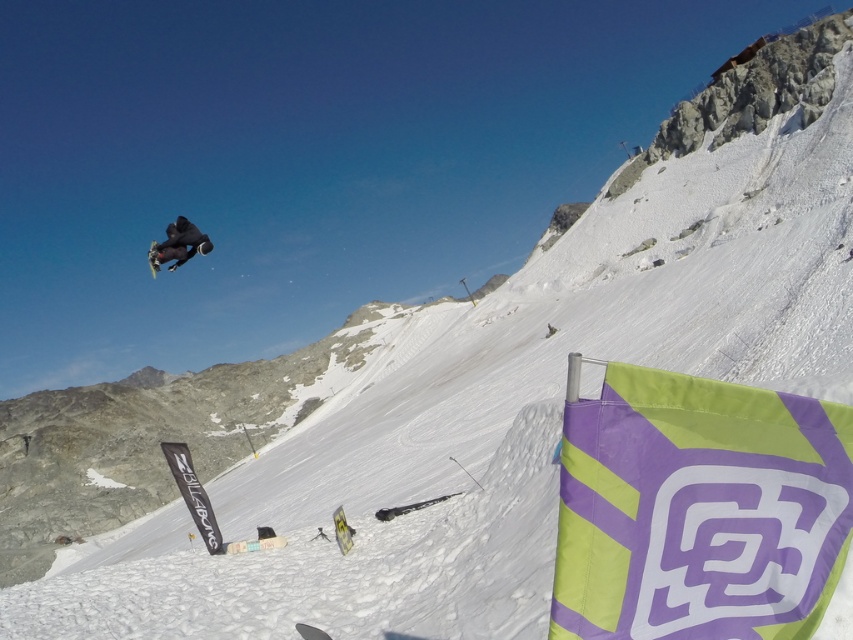
Question: Does black matte snowboarder at upper center have a lesser width compared to shiny black snowboard at upper left?

Choices:
 (A) yes
 (B) no

Answer: (A)

Question: Does black matte snowboarder at upper center have a greater width compared to shiny black snowboard at upper left?

Choices:
 (A) yes
 (B) no

Answer: (B)

Question: Among these objects, which one is farthest from the camera?

Choices:
 (A) shiny black snowboard at upper left
 (B) black matte snowboarder at upper center

Answer: (A)

Question: Which object appears farthest from the camera in this image?

Choices:
 (A) shiny black snowboard at upper left
 (B) black matte snowboarder at upper center

Answer: (A)

Question: Which point is farther to the camera?

Choices:
 (A) shiny black snowboard at upper left
 (B) black matte snowboarder at upper center

Answer: (A)

Question: In this image, where is black matte snowboarder at upper center located relative to shiny black snowboard at upper left?

Choices:
 (A) above
 (B) below

Answer: (B)